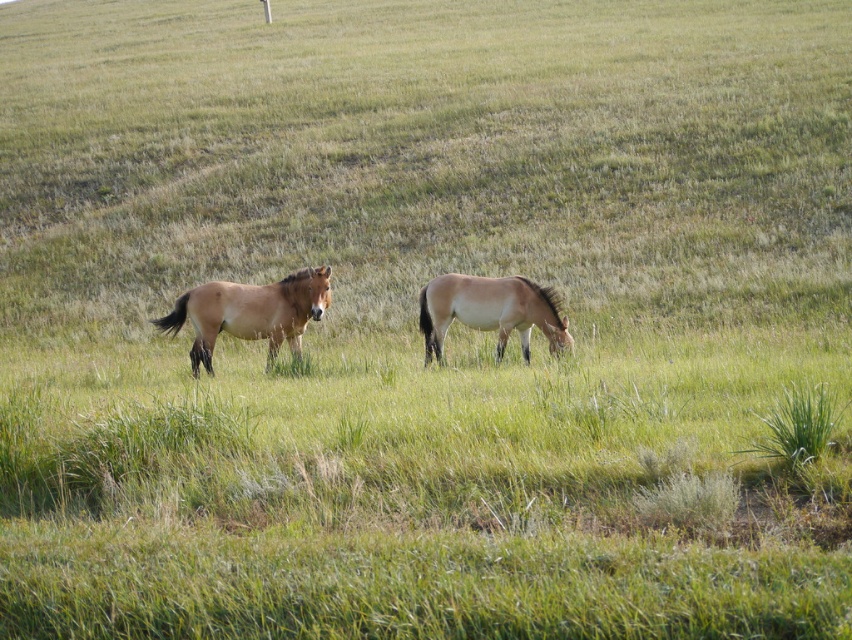
You are a farmer who wants to build a fence around the field where both the brown matte horse at center and the light brown glossy horse at center are grazing. The fence needs to accommodate the larger horse comfortably. Which horse should you consider when determining the required space for the fence?

The brown matte horse at center is larger in size than the light brown glossy horse at center, so you should consider the brown matte horse at center when determining the required space for the fence to accommodate it comfortably.